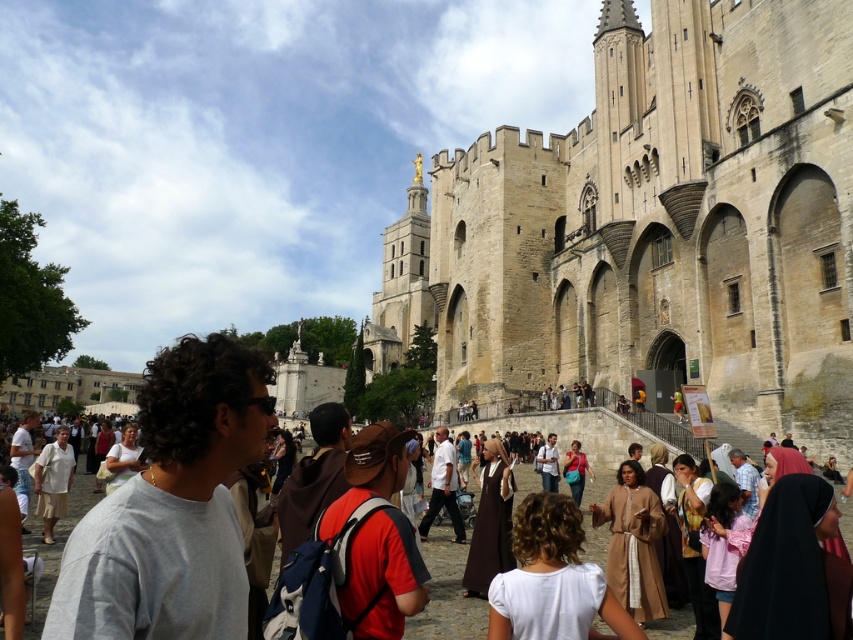
What is located at the point with coordinates (793, 568)?

The black velvet robe at lower right is located at point (793, 568).

You are standing at the entrance of the historic stone building and want to find the white cotton shirt at center. Based on the coordinates given, in which direction should you look to locate it?

The white cotton shirt at center is located at coordinates point (552, 579), which means you should look towards the lower right direction from your current position at the entrance to find it.